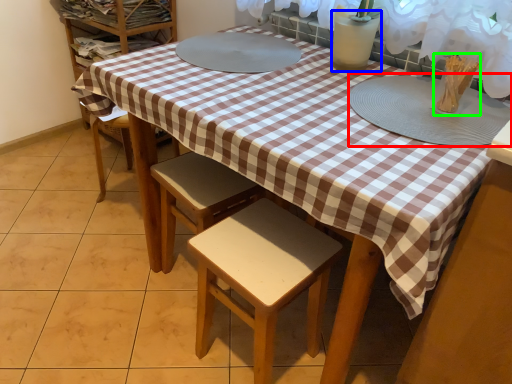
Question: Which object is positioned farthest from platter (highlighted by a red box)? Select from glass vase (highlighted by a blue box) and tableware (highlighted by a green box).

Choices:
 (A) glass vase
 (B) tableware

Answer: (A)